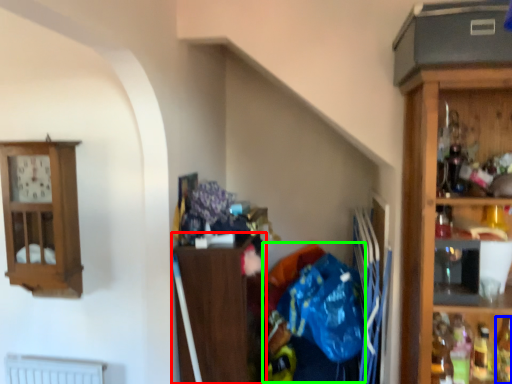
Question: Which object is positioned closest to cabinetry (highlighted by a red box)? Select from bottle (highlighted by a blue box) and waste (highlighted by a green box).

Choices:
 (A) bottle
 (B) waste

Answer: (B)